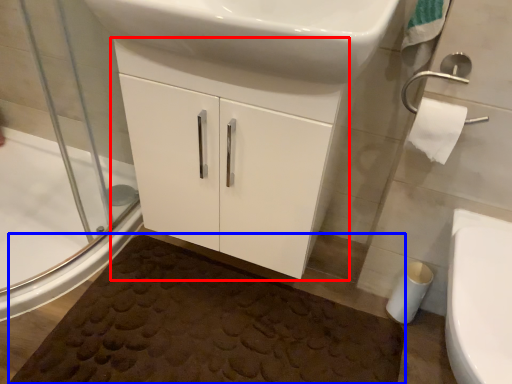
Question: Which object appears closest to the camera in this image, bathroom cabinet (highlighted by a red box) or bath mat (highlighted by a blue box)?

Choices:
 (A) bathroom cabinet
 (B) bath mat

Answer: (A)